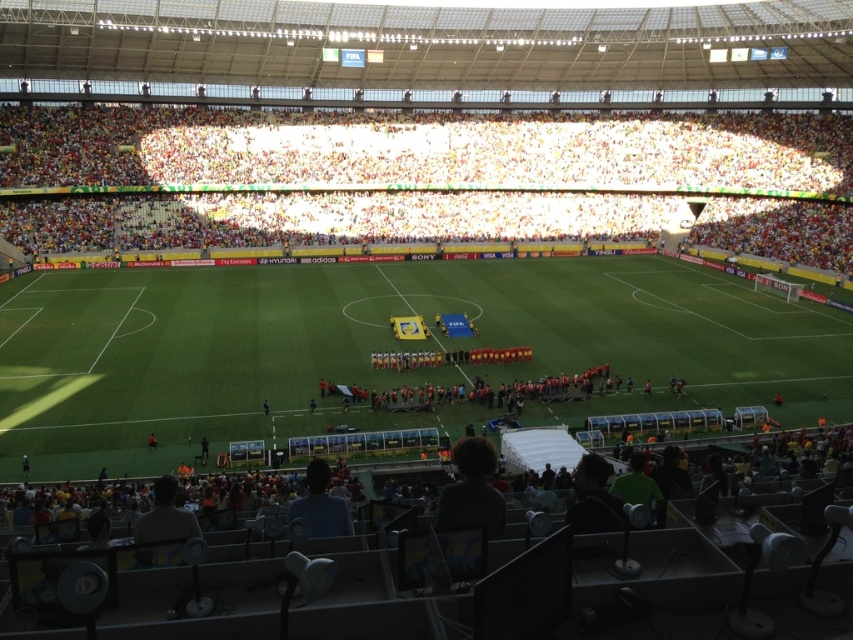
You are a drone operator tasked with capturing aerial footage of the stadium. You need to position your drone to focus on the white fabric crowd at upper center. According to the coordinates provided, where should you direct the drone?

The white fabric crowd at upper center is located at point (142, 144), so you should direct the drone to that coordinate to focus on it.

You are a stadium security officer needing to move from the dark gray shirt at lower left to the white fabric crowd at upper center. Given that your average walking speed is 1.5 meters per second, how many seconds will it take you to reach the crowd?

The distance between the dark gray shirt at lower left and the white fabric crowd at upper center is 83.93 meters. At a speed of 1.5 meters per second, the time required is 83.93 divided by 1.5, which equals approximately 55.95 seconds. Therefore, it will take about 56 seconds to reach the crowd.